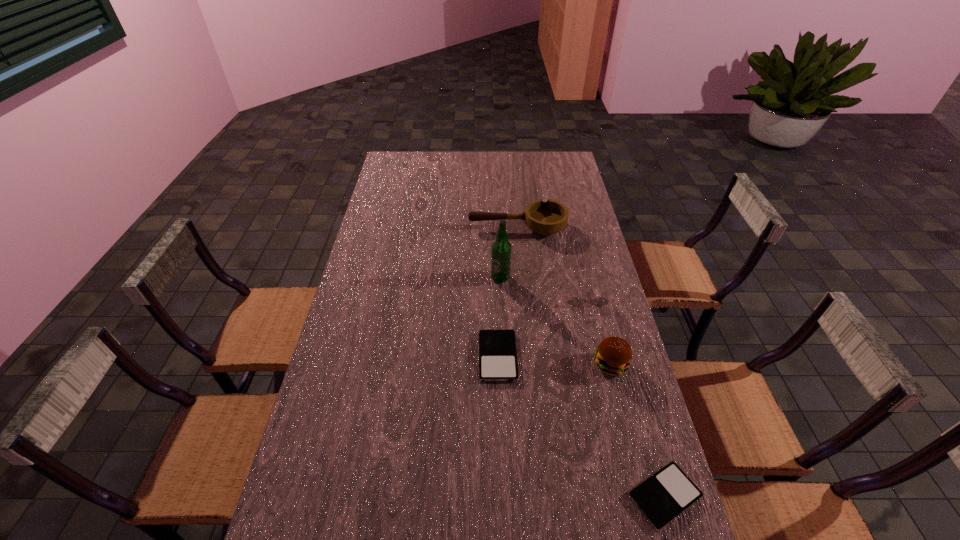
Find the location of `vacant area between the fourth nearest object and the shorter iPod`. vacant area between the fourth nearest object and the shorter iPod is located at coordinates (625, 395).

Where is `blank region between the third shortest object and the second tallest object`? This screenshot has height=540, width=960. blank region between the third shortest object and the second tallest object is located at coordinates (597, 330).

Identify which object is located as the third nearest to the third tallest object. Please provide its 2D coordinates. Your answer should be formatted as a tuple, i.e. [(x, y)], where the tuple contains the x and y coordinates of a point satisfying the conditions above.

[(497, 348)]

Point out which object is positioned as the second nearest to the fifth tallest object. Please provide its 2D coordinates. Your answer should be formatted as a tuple, i.e. [(x, y)], where the tuple contains the x and y coordinates of a point satisfying the conditions above.

[(501, 248)]

This screenshot has width=960, height=540. Identify the location of blank area in the image that satisfies the following two spatial constraints: 1. on the label of the fifth shortest object; 2. on the left side of the tallest object. (504, 364).

The image size is (960, 540). I want to click on free point that satisfies the following two spatial constraints: 1. on the front side of the hamburger; 2. on the right side of the right iPod, so click(643, 496).